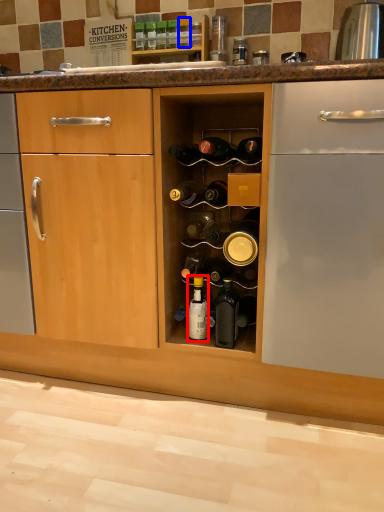
Question: Which object appears farthest to the camera in this image, bottle (highlighted by a red box) or bottle (highlighted by a blue box)?

Choices:
 (A) bottle
 (B) bottle

Answer: (B)